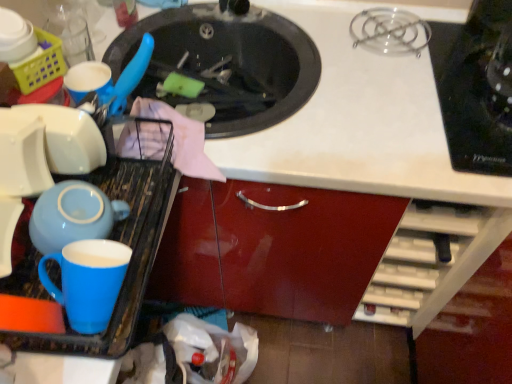
Where is `free space to the left of black glass cooktop at upper right`? This screenshot has height=384, width=512. free space to the left of black glass cooktop at upper right is located at coordinates (368, 110).